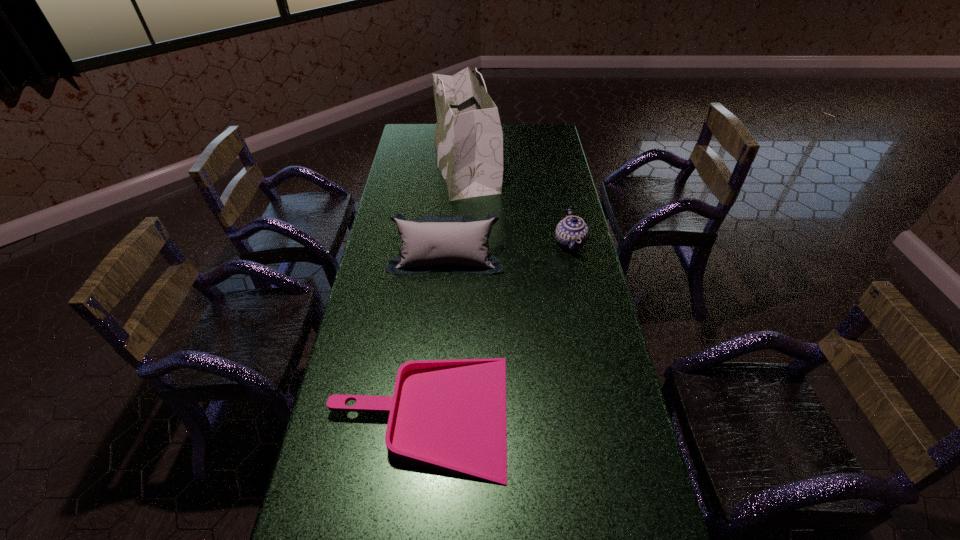
Image resolution: width=960 pixels, height=540 pixels. What are the coordinates of `the farthest object` in the screenshot? It's located at (469, 140).

What are the coordinates of `the tallest object` in the screenshot? It's located at (469, 140).

Locate an element on the screen. The width and height of the screenshot is (960, 540). cushion is located at coordinates (455, 243).

At what (x,y) coordinates should I click in order to perform the action: click on chinaware. Please return your answer as a coordinate pair (x, y). This screenshot has height=540, width=960. Looking at the image, I should click on (570, 230).

What are the coordinates of `the rightmost object` in the screenshot? It's located at (570, 230).

The image size is (960, 540). Find the location of `the shortest object`. the shortest object is located at coordinates (449, 415).

Locate an element on the screen. This screenshot has width=960, height=540. the nearest object is located at coordinates (449, 415).

I want to click on vacant point located on the right of the tallest object, so click(549, 163).

You are a GUI agent. You are given a task and a screenshot of the screen. Output one action in this format:
    pyautogui.click(x=<x>, y=<y>)
    Task: Click on the vacant area located on the surface of the third shortest object
    
    Given the screenshot: What is the action you would take?
    pyautogui.click(x=439, y=349)

This screenshot has width=960, height=540. Find the location of `blank space located at the spout of the second shortest object`. blank space located at the spout of the second shortest object is located at coordinates (501, 244).